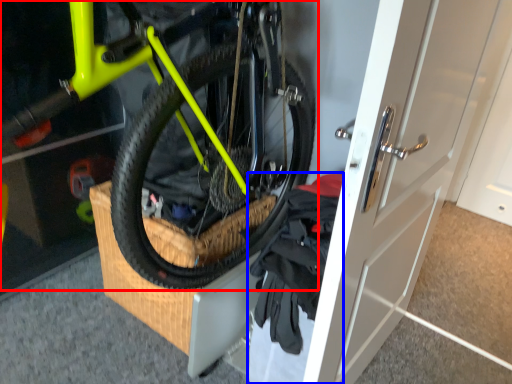
Question: Which object appears farthest to the camera in this image, bicycle (highlighted by a red box) or clothing (highlighted by a blue box)?

Choices:
 (A) bicycle
 (B) clothing

Answer: (B)